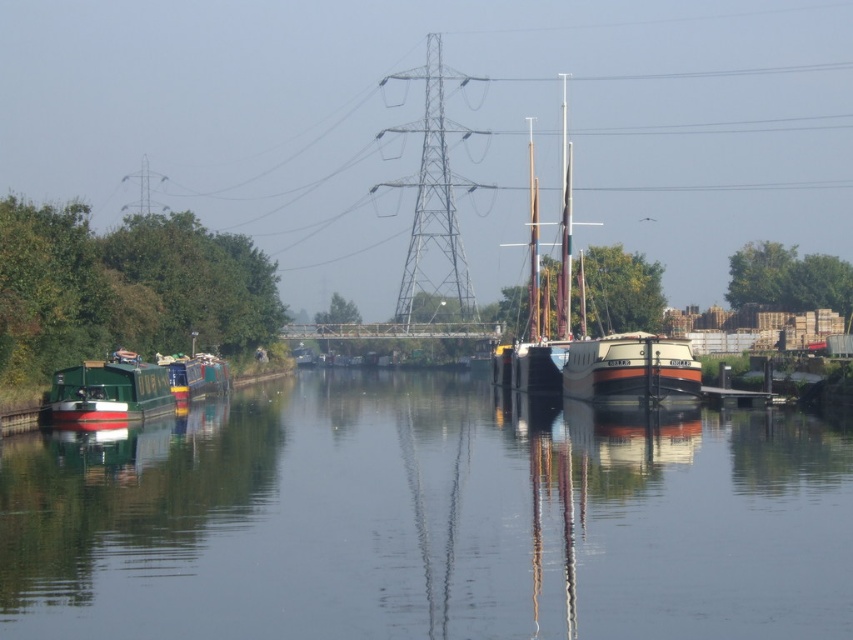
Question: Does wooden sailboat at center have a smaller size compared to green matte houseboat at left?

Choices:
 (A) yes
 (B) no

Answer: (B)

Question: Does green matte canal boat at center appear on the left side of green matte houseboat at left?

Choices:
 (A) yes
 (B) no

Answer: (B)

Question: Which of these objects is positioned farthest from the green matte canal boat at center?

Choices:
 (A) green matte houseboat at left
 (B) white glossy boat at center

Answer: (B)

Question: Is wooden sailboat at center behind green matte houseboat at left?

Choices:
 (A) no
 (B) yes

Answer: (B)

Question: Which object is closer to the camera taking this photo?

Choices:
 (A) wooden sailboat at center
 (B) green matte houseboat at left
 (C) green matte canal boat at center

Answer: (C)

Question: Which object appears closest to the camera in this image?

Choices:
 (A) green matte houseboat at left
 (B) white glossy boat at center
 (C) wooden sailboat at center

Answer: (A)